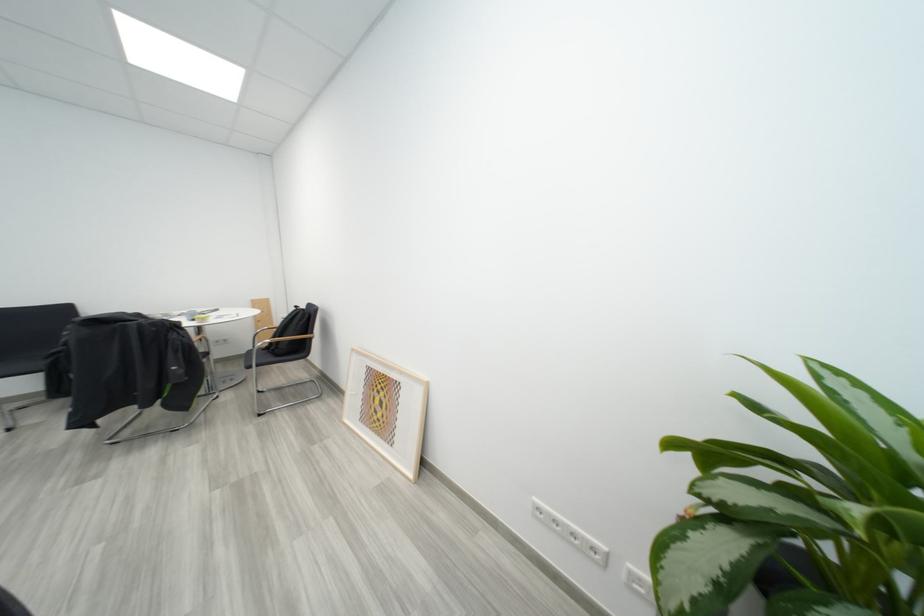
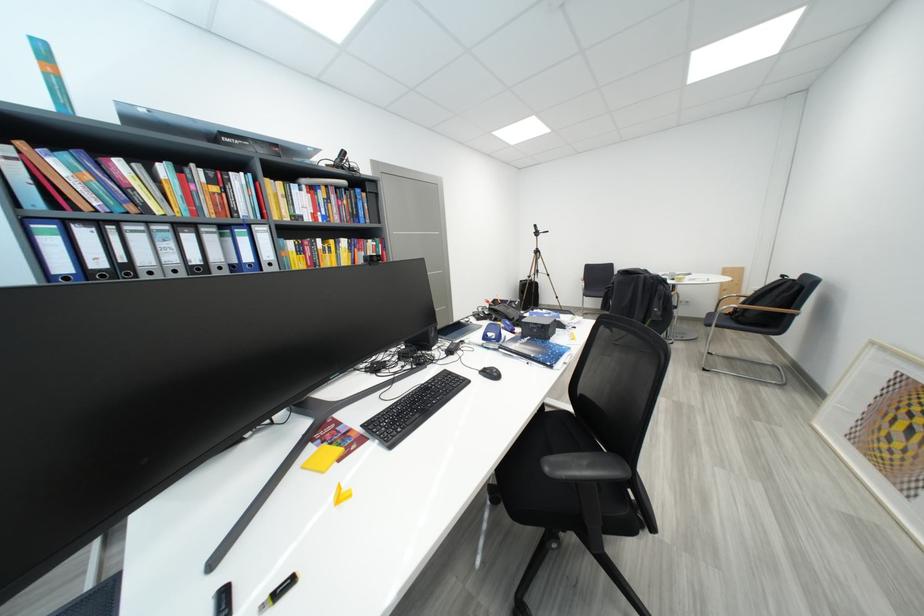
In the second image, find the point that corresponds to point (75, 312) in the first image.

(618, 269)